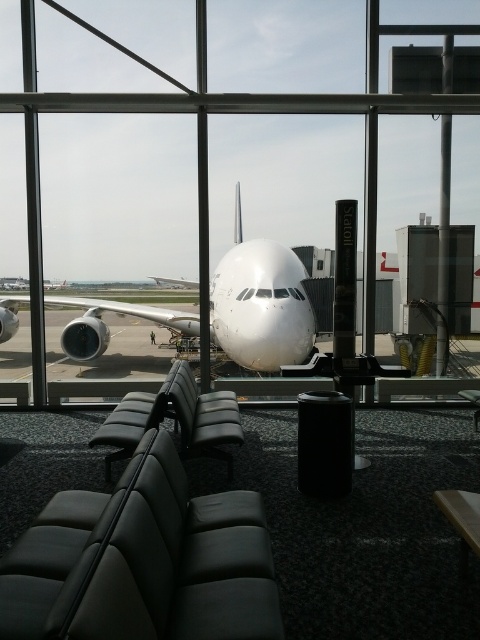
Between black leather chair at lower left and white glossy airplane at center, which one is positioned lower?

Positioned lower is black leather chair at lower left.

Is point (48, 608) closer to camera compared to point (284, 273)?

Yes, it is.

Image resolution: width=480 pixels, height=640 pixels. Find the location of `black leather chair at lower left`. black leather chair at lower left is located at coordinates (143, 561).

Is leather seat at center thinner than black leather chair at center?

Indeed, leather seat at center has a lesser width compared to black leather chair at center.

Which is below, leather seat at center or black leather chair at center?

black leather chair at center is below.

Is point (237, 413) more distant than point (124, 397)?

No.

Find the location of a particular element. leather seat at center is located at coordinates (203, 416).

Does black leather chair at lower left have a lesser width compared to black leather chair at center?

Correct, black leather chair at lower left's width is less than black leather chair at center's.

Who is more distant from viewer, [140,456] or [124,454]?

The point [124,454] is behind.

In order to click on black leather chair at lower left in this screenshot , I will do `click(143, 561)`.